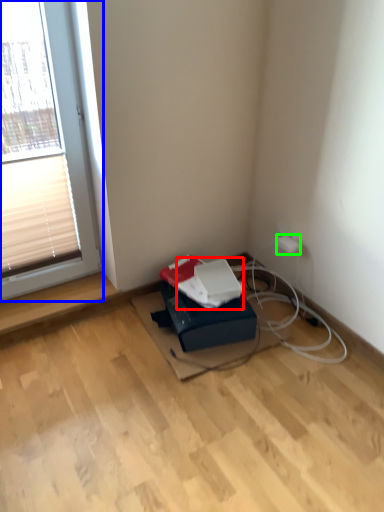
Question: Which object is the closest to the paperback book (highlighted by a red box)? Choose among these: window (highlighted by a blue box) or electric outlet (highlighted by a green box).

Choices:
 (A) window
 (B) electric outlet

Answer: (B)